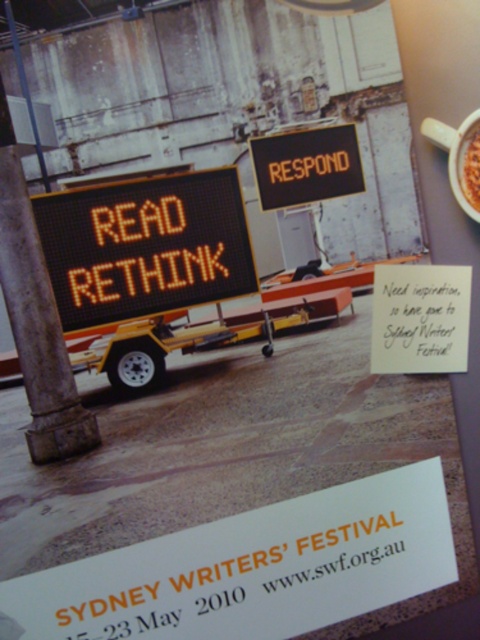
Is black matte sign at center positioned at the back of brown crumbly bread at upper right?

Yes.

Who is more distant from viewer, (322, 145) or (467, 157)?

The point (322, 145) is more distant.

The width and height of the screenshot is (480, 640). Describe the element at coordinates (307, 164) in the screenshot. I see `black matte sign at center` at that location.

I want to click on black matte sign at center, so tap(307, 164).

Can you confirm if orange led sign at center is positioned above gray stone pillar at left?

Yes.

Is orange led sign at center thinner than gray stone pillar at left?

Incorrect, orange led sign at center's width is not less than gray stone pillar at left's.

Who is more forward, [210,284] or [31,289]?

Point [31,289] is in front.

This screenshot has height=640, width=480. I want to click on orange led sign at center, so click(145, 246).

Between point (446, 147) and point (468, 188), which one is positioned behind?

Point (446, 147)

Who is shorter, brown matte cup at upper right or brown crumbly bread at upper right?

Standing shorter between the two is brown crumbly bread at upper right.

Between point (444, 128) and point (470, 148), which one is positioned in front?

Point (470, 148) is more forward.

You are a GUI agent. You are given a task and a screenshot of the screen. Output one action in this format:
    pyautogui.click(x=<x>, y=<y>)
    Task: Click on the brown matte cup at upper right
    
    Given the screenshot: What is the action you would take?
    pyautogui.click(x=459, y=157)